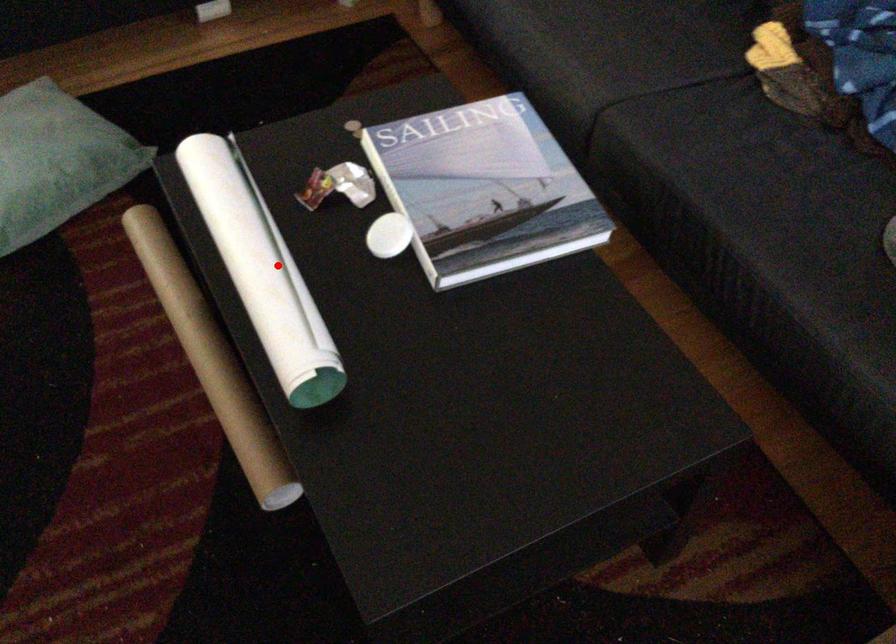
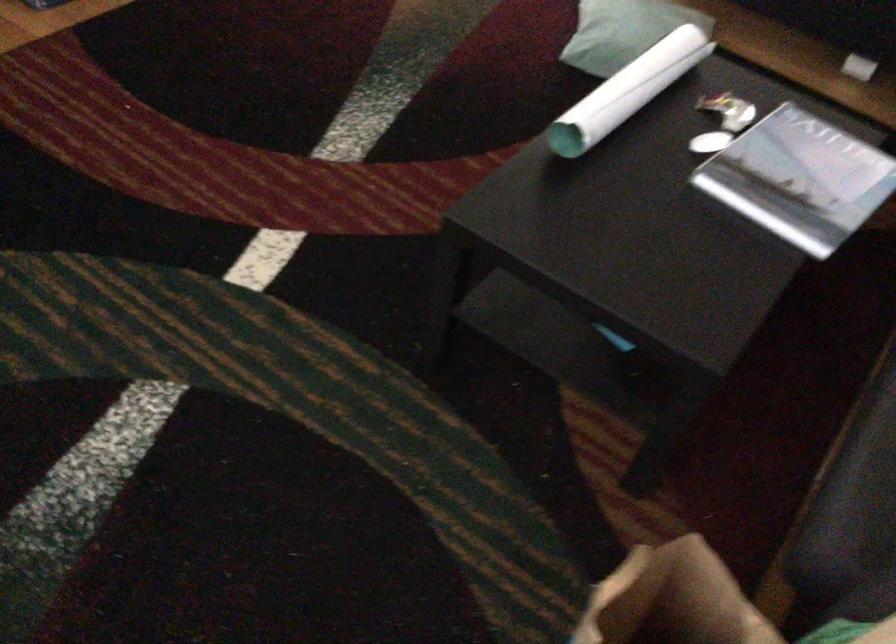
Question: I am providing you with two images of the same scene from different viewpoints. In image1, a red point is highlighted. Considering the same 3D point in image2, which of the following is correct?

Choices:
 (A) It is closer
 (B) It is farther

Answer: (B)